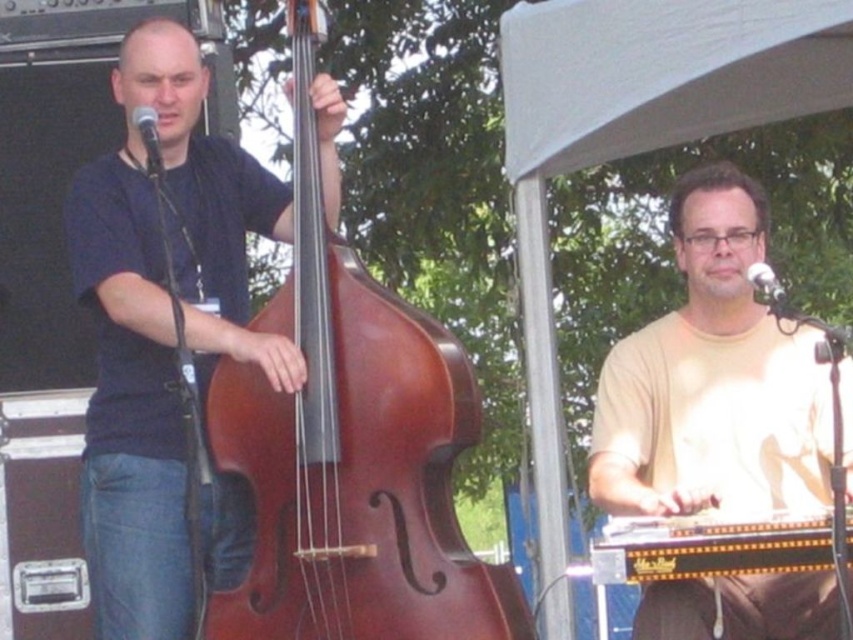
Question: Which object is positioned closest to the metallic silver microphone at upper right?

Choices:
 (A) brown polished wood cello at center
 (B) matte black double bass at left

Answer: (A)

Question: Among these objects, which one is farthest from the camera?

Choices:
 (A) light beige t-shirt at center
 (B) matte black double bass at left
 (C) matte black microphone at upper left
 (D) metallic silver microphone at upper right

Answer: (D)

Question: Can you confirm if light beige t-shirt at center is wider than metallic silver microphone at upper right?

Choices:
 (A) no
 (B) yes

Answer: (B)

Question: Which point is closer to the camera?

Choices:
 (A) (637, 579)
 (B) (766, 275)
 (C) (463, 586)

Answer: (A)

Question: Is brown polished wood cello at center smaller than matte black double bass at left?

Choices:
 (A) yes
 (B) no

Answer: (A)

Question: Is matte black double bass at left thinner than matte black microphone at upper left?

Choices:
 (A) yes
 (B) no

Answer: (B)